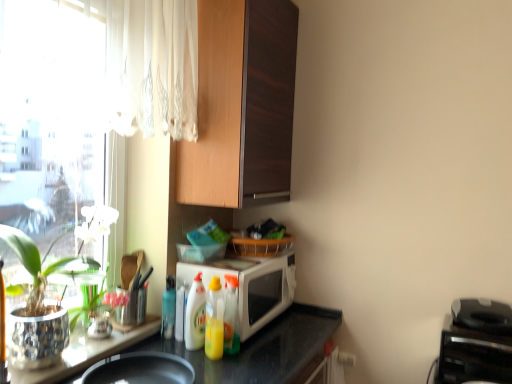
Question: Which direction should I rotate to look at translucent plastic bottle at center, positioned as the 4th bottle in left-to-right order, — up or down?

Choices:
 (A) up
 (B) down

Answer: (B)

Question: Is the depth of white glossy microwave at center greater than that of black plastic toaster at lower right?

Choices:
 (A) yes
 (B) no

Answer: (A)

Question: Considering the relative sizes of white glossy microwave at center and black plastic toaster at lower right in the image provided, is white glossy microwave at center bigger than black plastic toaster at lower right?

Choices:
 (A) no
 (B) yes

Answer: (B)

Question: Can you confirm if white glossy microwave at center is thinner than black plastic toaster at lower right?

Choices:
 (A) no
 (B) yes

Answer: (A)

Question: Can you confirm if white glossy microwave at center is smaller than black plastic toaster at lower right?

Choices:
 (A) yes
 (B) no

Answer: (B)

Question: Is white glossy microwave at center completely or partially outside of black plastic toaster at lower right?

Choices:
 (A) no
 (B) yes

Answer: (B)

Question: Does white glossy microwave at center appear on the left side of black plastic toaster at lower right?

Choices:
 (A) yes
 (B) no

Answer: (A)

Question: Is yellow translucent bottle at center, which appears as the 3th bottle when viewed from the left, oriented towards white glossy bottle at center, which is the 2th bottle from left to right?

Choices:
 (A) no
 (B) yes

Answer: (B)

Question: From the image's perspective, would you say yellow translucent bottle at center, the second bottle in the right-to-left sequence, is shown under white glossy bottle at center, which is the 2th bottle from left to right?

Choices:
 (A) yes
 (B) no

Answer: (A)

Question: Does yellow translucent bottle at center, the second bottle in the right-to-left sequence, have a greater width compared to white glossy bottle at center, which is the 2th bottle from left to right?

Choices:
 (A) yes
 (B) no

Answer: (A)

Question: From the image's perspective, is yellow translucent bottle at center, which appears as the 3th bottle when viewed from the left, over white glossy bottle at center, which is the 2th bottle from left to right?

Choices:
 (A) no
 (B) yes

Answer: (A)

Question: Is yellow translucent bottle at center, which appears as the 3th bottle when viewed from the left, outside of white glossy bottle at center, which is the 2th bottle from left to right?

Choices:
 (A) yes
 (B) no

Answer: (A)

Question: Is yellow translucent bottle at center, which appears as the 3th bottle when viewed from the left, in front of white glossy bottle at center, the third bottle in the right-to-left sequence?

Choices:
 (A) no
 (B) yes

Answer: (B)

Question: From a real-world perspective, does translucent plastic bottle at center, positioned as the 4th bottle in left-to-right order, sit lower than black plastic toaster at lower right?

Choices:
 (A) no
 (B) yes

Answer: (A)